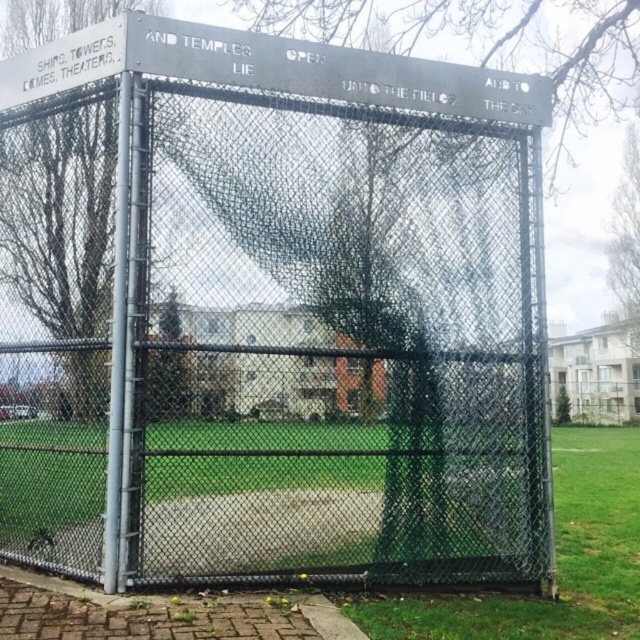
You are standing at the edge of the sports field looking towards the fence. You notice two patches of green grass at lower center and green grass at lower right. Which patch is higher up from the ground?

The green grass at lower center is located above the green grass at lower right, so the green grass at lower center is higher up from the ground.

You are standing in front of the fence and looking at the two areas of green grass at lower center and green grass at lower right. Which one is positioned to the left?

The green grass at lower center is positioned to the left of the green grass at lower right.